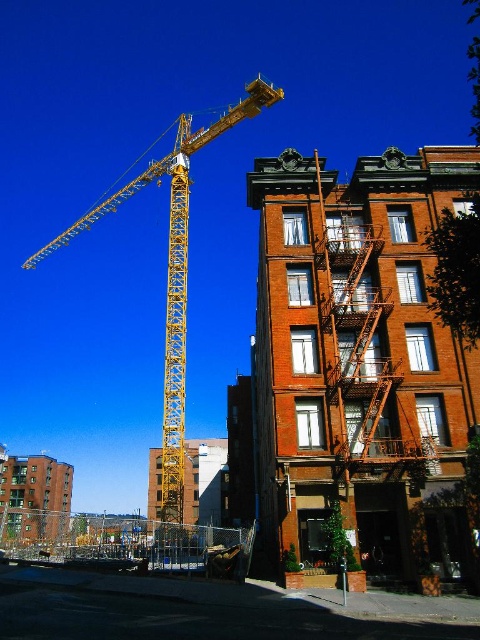
Is rusty metal fire escape at center-right to the right of yellow metallic crane at upper left from the viewer's perspective?

Indeed, rusty metal fire escape at center-right is positioned on the right side of yellow metallic crane at upper left.

Does point (386, 403) lie in front of point (218, 129)?

That is True.

Locate an element on the screen. Image resolution: width=480 pixels, height=640 pixels. rusty metal fire escape at center-right is located at coordinates (369, 324).

The width and height of the screenshot is (480, 640). In order to click on rusty metal fire escape at center-right in this screenshot , I will do `click(369, 324)`.

Who is shorter, brick building at center or rusty metal fire escape at center-right?

rusty metal fire escape at center-right is shorter.

Is point (276, 328) closer to viewer compared to point (340, 196)?

Yes, point (276, 328) is closer to viewer.

This screenshot has width=480, height=640. In order to click on brick building at center in this screenshot , I will do [360, 362].

Does brick building at center lie in front of yellow metallic crane at upper left?

Yes, brick building at center is in front of yellow metallic crane at upper left.

From the picture: Who is more distant from viewer, (352, 497) or (169, 168)?

The point (169, 168) is behind.

Identify the location of brick building at center. This screenshot has width=480, height=640. (360, 362).

Find the location of a particular element. The image size is (480, 640). brick building at center is located at coordinates (360, 362).